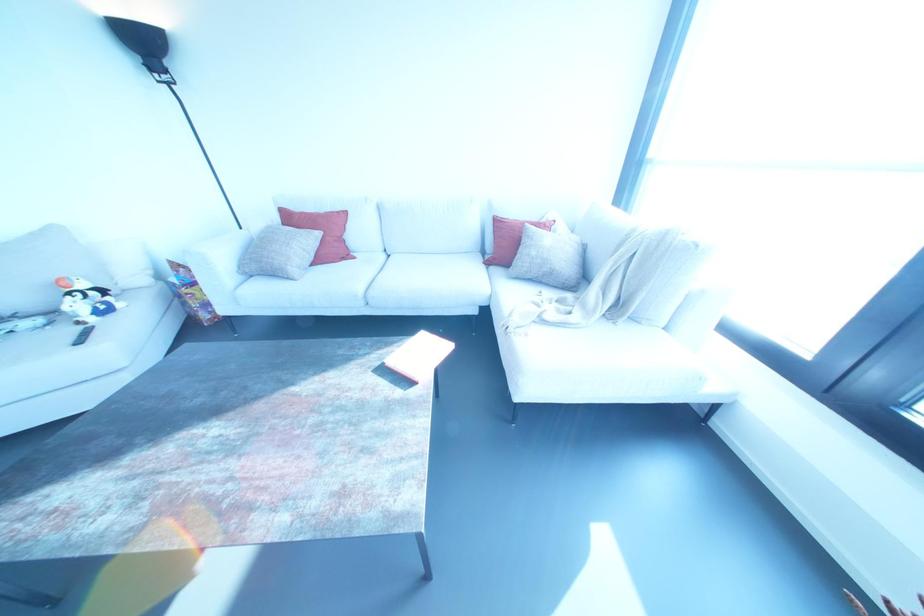
Where would you open the red book? Please return your answer as a coordinate pair (x, y).

(419, 355)